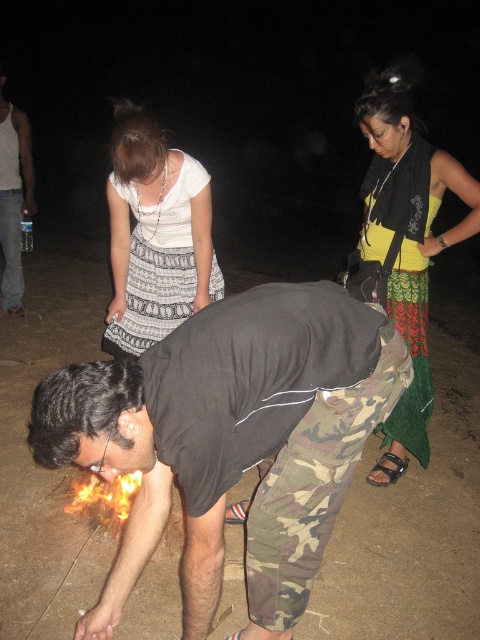
Is black matte shirt at center further to the viewer compared to yellow-green printed skirt at center?

No, it is not.

Does black matte shirt at center appear over yellow-green printed skirt at center?

No, black matte shirt at center is not above yellow-green printed skirt at center.

Is point (207, 401) farther from viewer compared to point (396, 140)?

No.

This screenshot has width=480, height=640. I want to click on black matte shirt at center, so click(231, 440).

Is point (113, 353) closer to camera compared to point (22, 160)?

Yes, it is in front of point (22, 160).

Is camouflage pants at center wider than white tank top at left?

Indeed, camouflage pants at center has a greater width compared to white tank top at left.

Find the location of `camouflage pants at center`. camouflage pants at center is located at coordinates (152, 296).

This screenshot has height=640, width=480. I want to click on camouflage pants at center, so click(152, 296).

Can you confirm if camouflage pants at center is positioned to the right of flaming wood at lower left?

Yes, camouflage pants at center is to the right of flaming wood at lower left.

In order to click on camouflage pants at center in this screenshot , I will do `click(152, 296)`.

Identify the location of camouflage pants at center. [x=152, y=296].